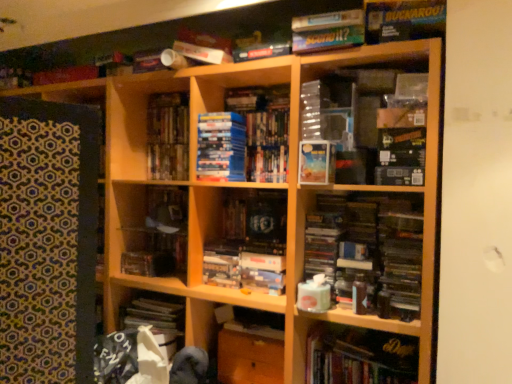
Question: Based on their positions, is matte blue paperback book at center located to the left or right of wooden cabinet at center, the 2th cabinet positioned from the top?

Choices:
 (A) left
 (B) right

Answer: (B)

Question: Does point (305, 157) appear closer or farther from the camera than point (253, 370)?

Choices:
 (A) farther
 (B) closer

Answer: (B)

Question: Considering the real-world distances, which object is closest to the blue matte book at center, which ranks as the second book in bottom-to-top order?

Choices:
 (A) wooden shelf at center, which is the 1th cabinet from top to bottom
 (B) wooden cabinet at center, which is the 1th cabinet from bottom to top
 (C) hardcover books at center, marked as the fourth book in a bottom-to-top arrangement
 (D) matte blue paperback book at center
 (E) matte cardboard book at upper right, positioned as the fifth book in bottom-to-top order

Answer: (C)

Question: Considering the real-world distances, which object is closest to the wooden shelf at center, the 1th cabinet when ordered from left to right?

Choices:
 (A) hardcover book at lower right, arranged as the first book when ordered from the bottom
 (B) blue cardboard book at center, which is counted as the third book, starting from the bottom
 (C) wooden cabinet at center, which appears as the 1th cabinet when viewed from the right
 (D) matte board game at upper center, the 6th book in the bottom-to-top sequence
 (E) hardcover books at center, which ranks as the 3th book in top-to-bottom order

Answer: (C)